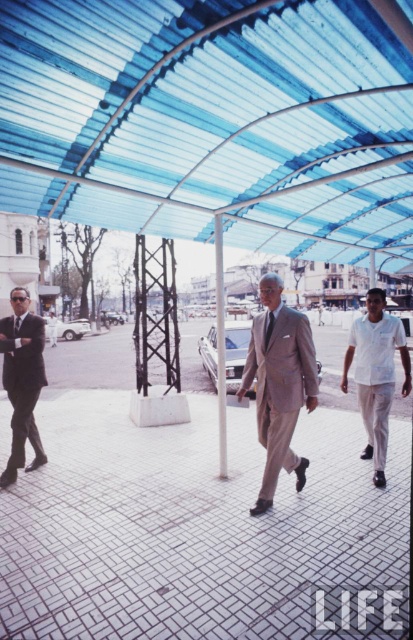
Looking at this image, how distant is light gray suit at center from matte black suit at left?

A distance of 8.41 feet exists between light gray suit at center and matte black suit at left.

Can you confirm if light gray suit at center is positioned to the right of matte black suit at left?

Indeed, light gray suit at center is positioned on the right side of matte black suit at left.

I want to click on light gray suit at center, so click(x=279, y=385).

Does white tile pavement at center have a smaller size compared to light gray suit at center?

Actually, white tile pavement at center might be larger than light gray suit at center.

Does point (362, 605) lie in front of point (280, 323)?

Yes, point (362, 605) is in front of point (280, 323).

In order to click on white tile pavement at center in this screenshot , I will do `click(197, 525)`.

Between transparent plastic canopy at center and white tile pavement at center, which one is positioned lower?

white tile pavement at center

Is transparent plastic canopy at center below white tile pavement at center?

No.

Does point (139, 64) come behind point (106, 394)?

No, it is not.

At what (x,y) coordinates should I click in order to perform the action: click on transparent plastic canopy at center. Please return your answer as a coordinate pair (x, y). This screenshot has width=413, height=640. Looking at the image, I should click on (215, 120).